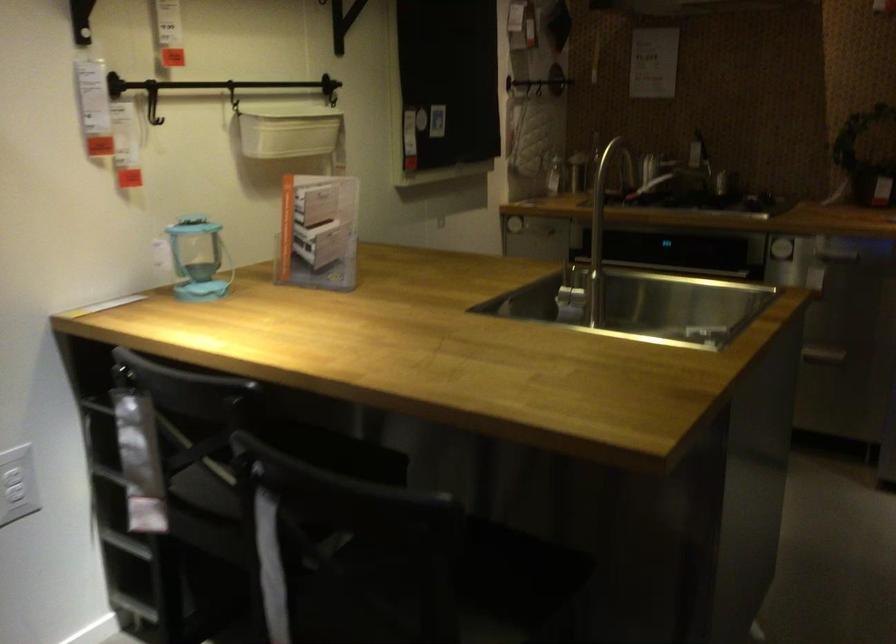
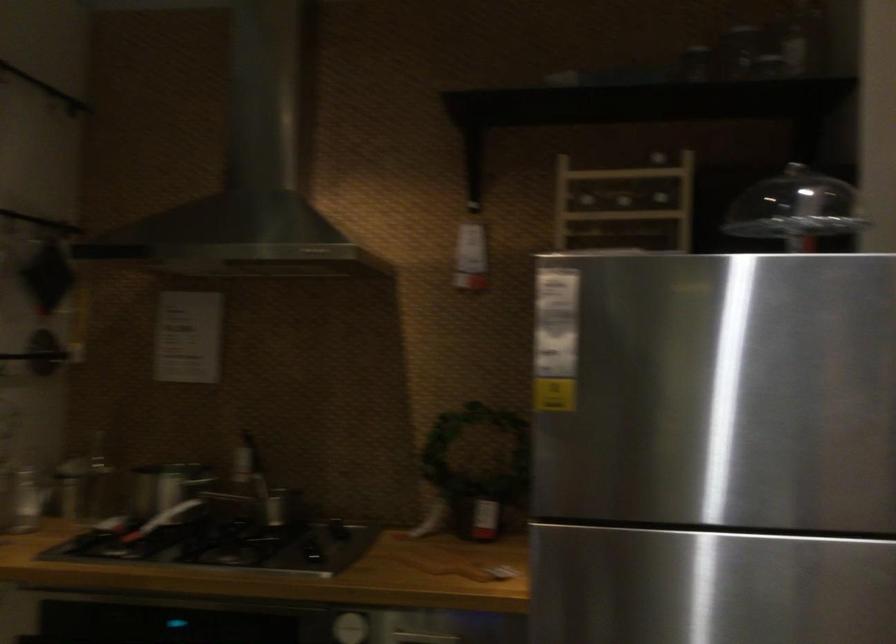
The point at (713, 140) is marked in the first image. Where is the corresponding point in the second image?

(243, 459)